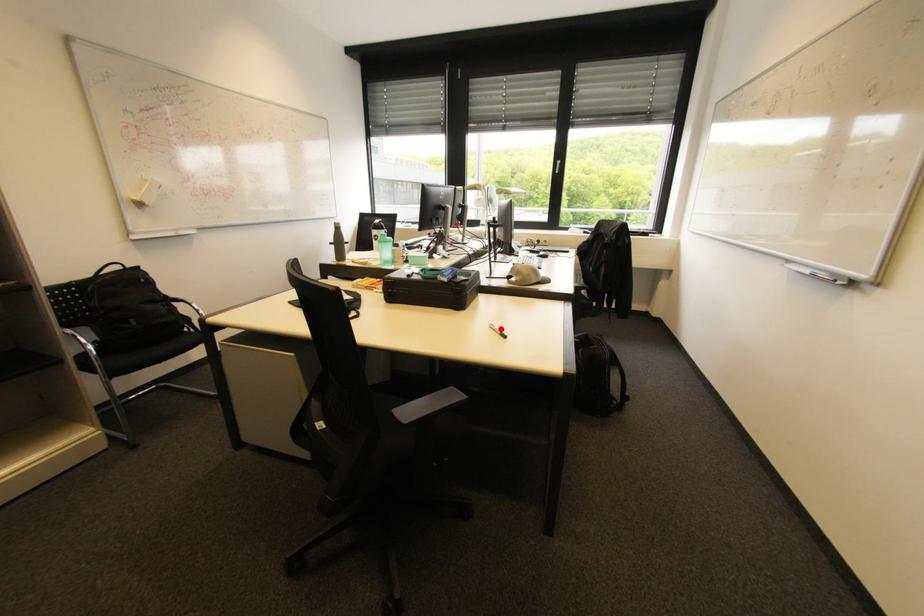
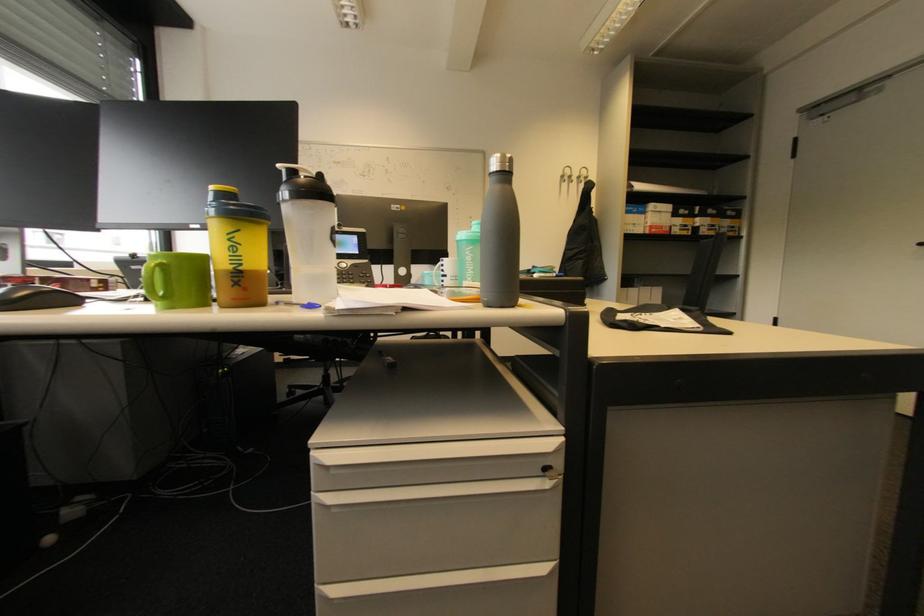
Question: I am providing you with two images of the same scene from different viewpoints. A red point is marked on the first image. Is the red point's position out of view in image 2?

Choices:
 (A) Yes
 (B) No

Answer: (A)